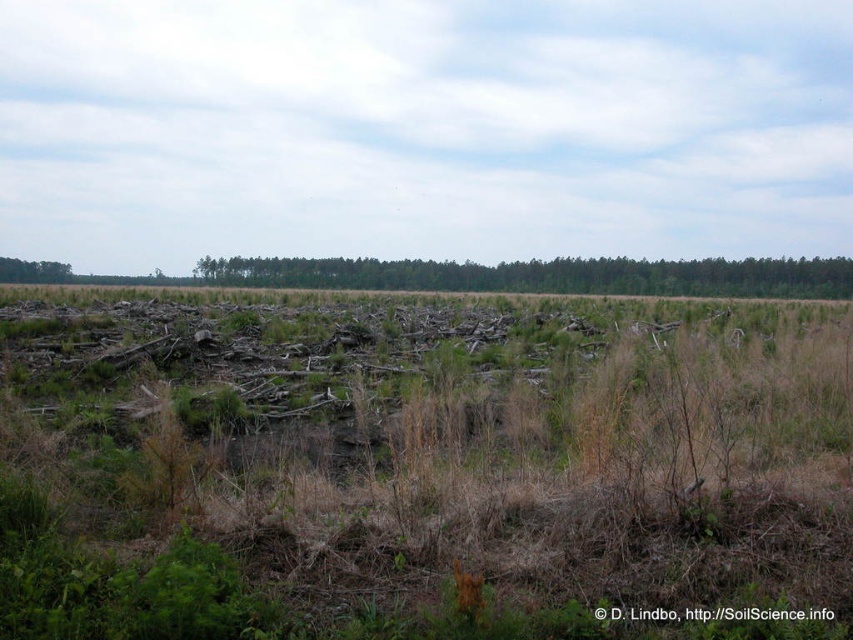
Is point (403, 260) positioned before point (45, 276)?

No.

Which is below, green leafy trees at center or green leafy tree at upper left?

green leafy trees at center

Where is `green leafy trees at center`? The width and height of the screenshot is (853, 640). green leafy trees at center is located at coordinates (544, 275).